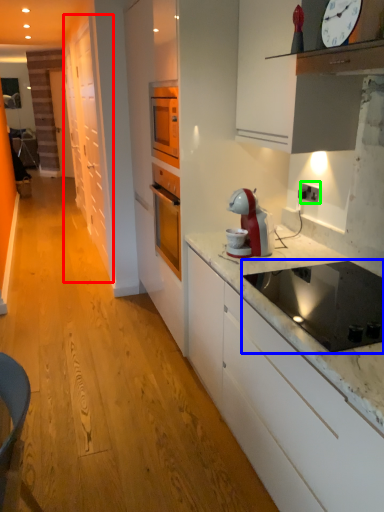
Question: Which object is the farthest from cabinetry (highlighted by a red box)? Choose among these: kitchen appliance (highlighted by a blue box) or electric outlet (highlighted by a green box).

Choices:
 (A) kitchen appliance
 (B) electric outlet

Answer: (A)